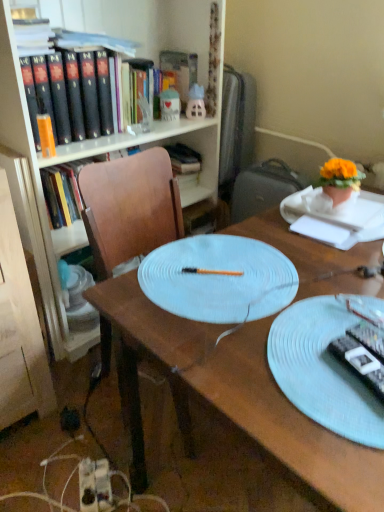
Question: Is point (150, 109) positioned closer to the camera than point (372, 366)?

Choices:
 (A) farther
 (B) closer

Answer: (A)

Question: Relative to black plastic remote control at lower right, the 1th remote control positioned from the left, is matte wood bookcase at upper left in front or behind?

Choices:
 (A) front
 (B) behind

Answer: (B)

Question: Which object is the closest to the black plastic remote control at lower right, which appears as the second remote control when viewed from the right?

Choices:
 (A) matte plastic toy at upper center, placed as the first toy when sorted from left to right
 (B) matte wood bookcase at upper left
 (C) light blue textured plate at center
 (D) wooden desk at center
 (E) orange fabric flower pot at upper right

Answer: (C)

Question: Considering the real-world distances, which object is closest to the black plastic remote control at lower right, which appears as the second remote control when viewed from the right?

Choices:
 (A) hardcover book at upper center
 (B) matte plastic toy at upper center, placed as the first toy when sorted from left to right
 (C) light blue textured plate at center
 (D) matte pink plastic toy at upper center, the second toy positioned from the left
 (E) orange fabric flower pot at upper right

Answer: (C)